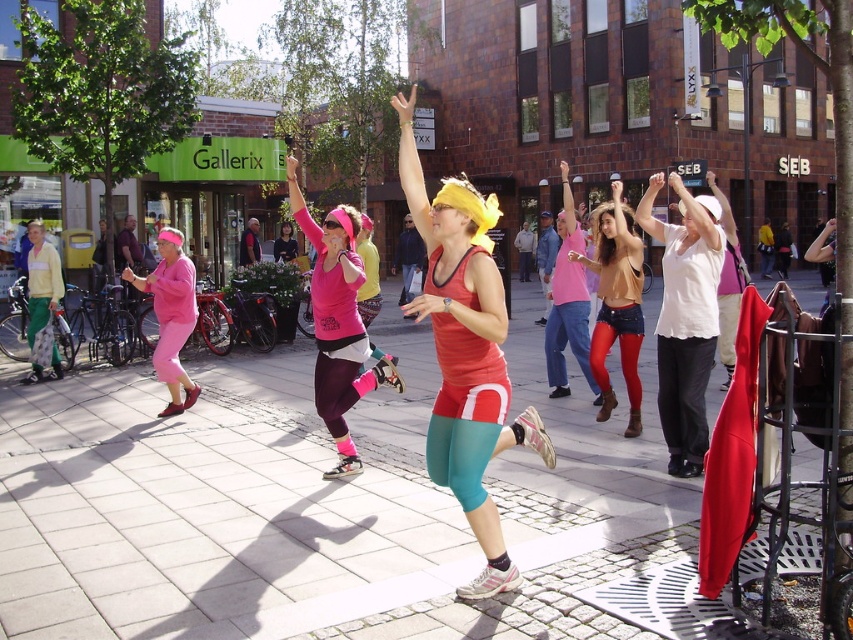
You are a photographer positioned on the sidewalk trying to capture the matte red tank top at center and the pink matte leggings at center in your shot. Which piece of clothing will appear closer to the camera in the photo?

The matte red tank top at center will appear closer to the camera because it is in front of the pink matte leggings at center in the scene.

Looking at this image, you are a photographer standing at the edge of the exercise class scene. You want to capture a photo of the matte brown leather boots at center. Based on their coordinates, where should you position your camera to ensure they are centered in your shot?

To center the matte brown leather boots at center in your photo, position your camera directly facing the coordinates point (616, 304) where the boots are located.